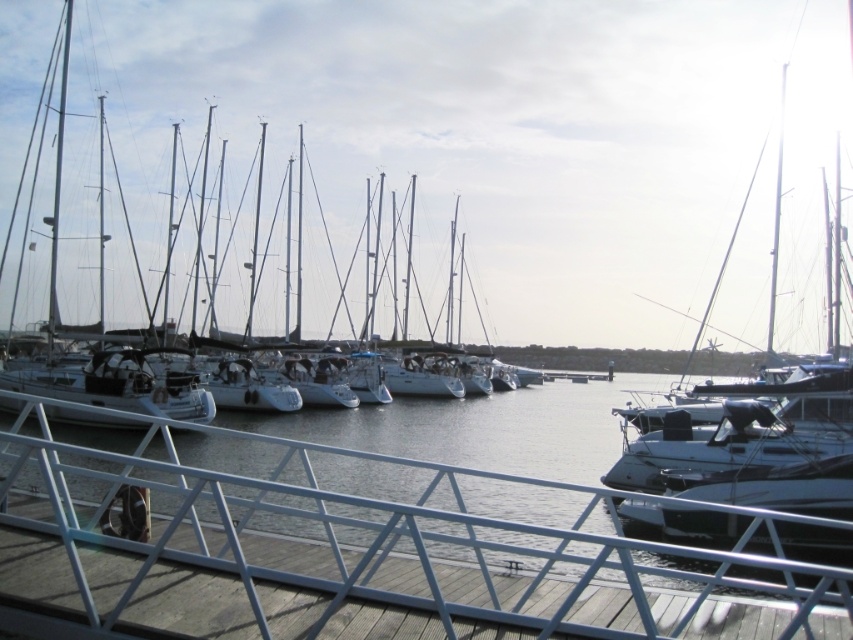
You are standing on the wooden dock and want to board the white glossy sailboat at center. Is the white metal rail at lower center blocking your path to the sailboat?

The white glossy sailboat at center is positioned over the white metal rail at lower center, so the rail is directly below the sailboat and not blocking your path.

You are standing on the wooden dock with a metal railing painted in a light blue color. You see a point at coordinates point (453, 147). Which object is this point located on?

The point (453, 147) is located on the white glossy sailboat at center.

You are standing on the dock and want to take a photo of the white glossy sailboat at center. If you need to be within 100 feet to get a clear photo, can you take a clear photo from where you are?

The white glossy sailboat at center is 99.34 feet away from camera, so yes, you can take a clear photo since it is within the 100 feet range.